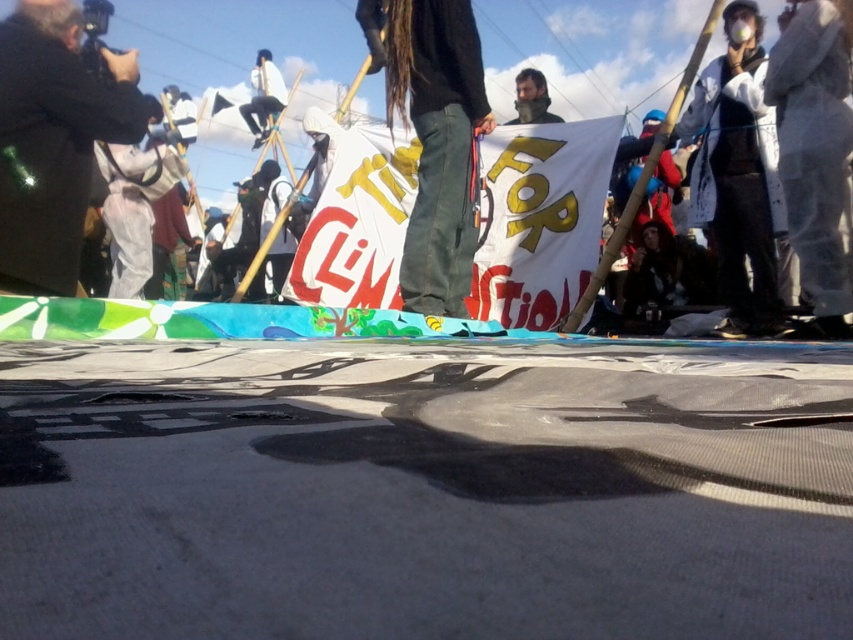
Question: Does white fabric mask at upper right lie in front of smooth black jacket at upper center?

Choices:
 (A) yes
 (B) no

Answer: (A)

Question: Estimate the real-world distances between objects in this image. Which object is farther from the smooth black jacket at upper center?

Choices:
 (A) white fabric mask at upper right
 (B) dark gray jacket at left

Answer: (B)

Question: From the image, what is the correct spatial relationship of dark gray jacket at left in relation to white fabric mask at upper right?

Choices:
 (A) right
 (B) left

Answer: (B)

Question: Which object is farther from the camera taking this photo?

Choices:
 (A) white fabric mask at upper right
 (B) smooth black jacket at upper center

Answer: (B)

Question: Which object is closer to the camera taking this photo?

Choices:
 (A) smooth black jacket at upper center
 (B) white fabric mask at upper right

Answer: (B)

Question: Is dark gray jacket at left smaller than white fabric mask at upper right?

Choices:
 (A) yes
 (B) no

Answer: (B)